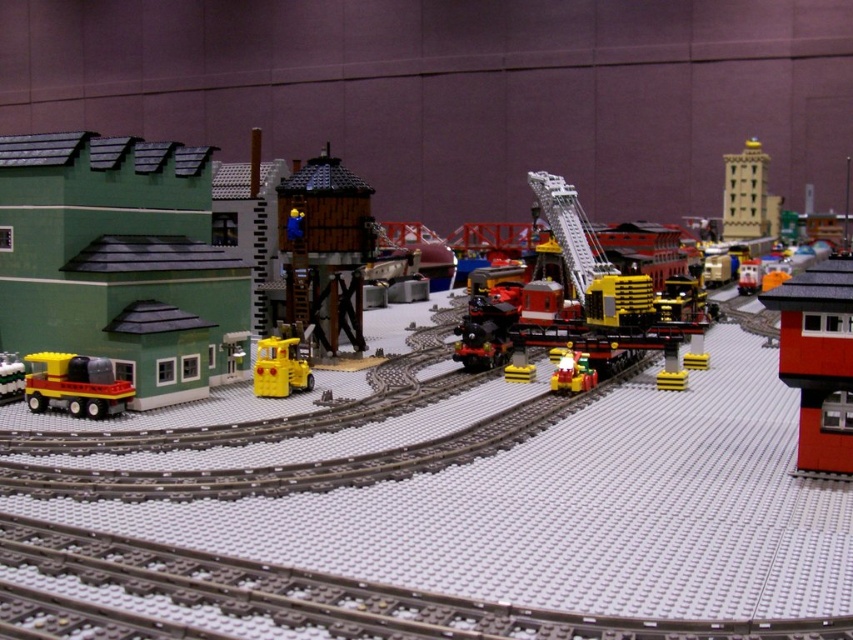
Consider the image. Who is more distant from viewer, [140,358] or [45,372]?

Point [45,372]

You are a GUI agent. You are given a task and a screenshot of the screen. Output one action in this format:
    pyautogui.click(x=<x>, y=<y>)
    Task: Click on the matte green building at left
    This screenshot has height=640, width=853.
    Given the screenshot: What is the action you would take?
    pyautogui.click(x=120, y=260)

Which is more to the right, wooden tower at center or matte yellow truck at lower left?

From the viewer's perspective, wooden tower at center appears more on the right side.

Does wooden tower at center lie behind matte yellow truck at lower left?

Yes, wooden tower at center is behind matte yellow truck at lower left.

What do you see at coordinates (325, 248) in the screenshot? I see `wooden tower at center` at bounding box center [325, 248].

Find the location of a particular element. Image resolution: width=853 pixels, height=640 pixels. wooden tower at center is located at coordinates (325, 248).

Does matte yellow truck at center have a lesser height compared to matte yellow truck at lower left?

In fact, matte yellow truck at center may be taller than matte yellow truck at lower left.

Does matte yellow truck at center have a smaller size compared to matte yellow truck at lower left?

No.

Locate an element on the screen. The width and height of the screenshot is (853, 640). matte yellow truck at center is located at coordinates (280, 368).